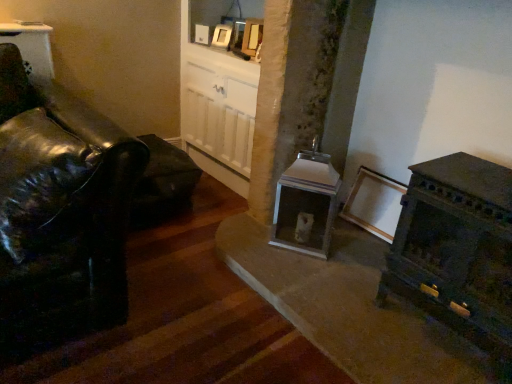
At what (x,y) coordinates should I click in order to perform the action: click on vacant area situated below metallic silver fireplace at center (from a real-world perspective). Please return your answer as a coordinate pair (x, y). Looking at the image, I should click on (298, 253).